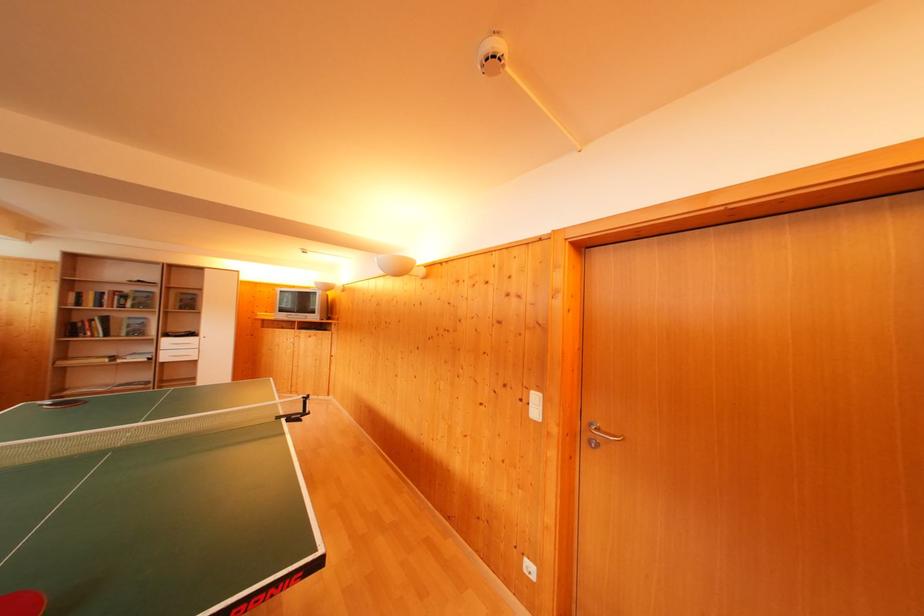
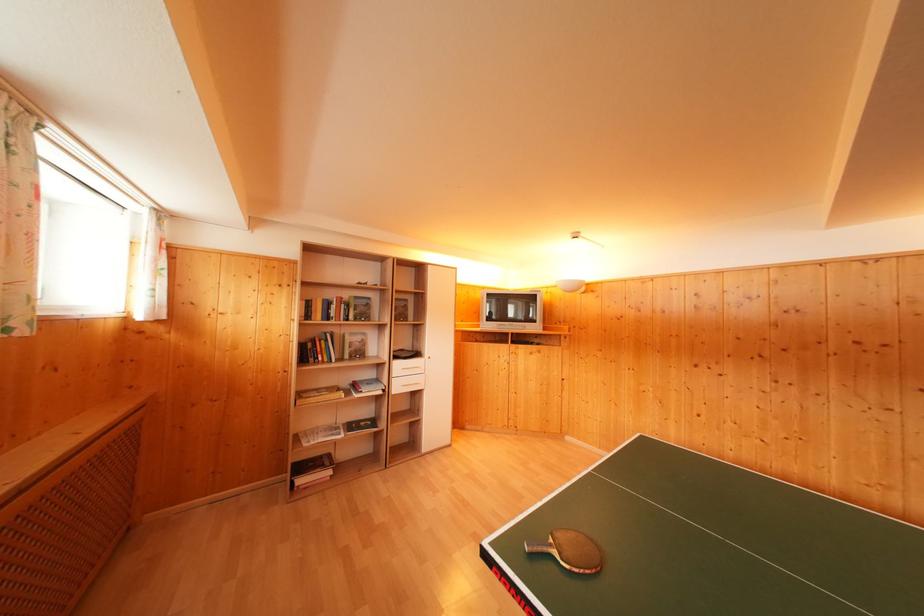
Question: In a continuous first-person perspective shot, in which direction is the camera moving?

Choices:
 (A) Left
 (B) Right
 (C) Forward
 (D) Backward

Answer: (A)